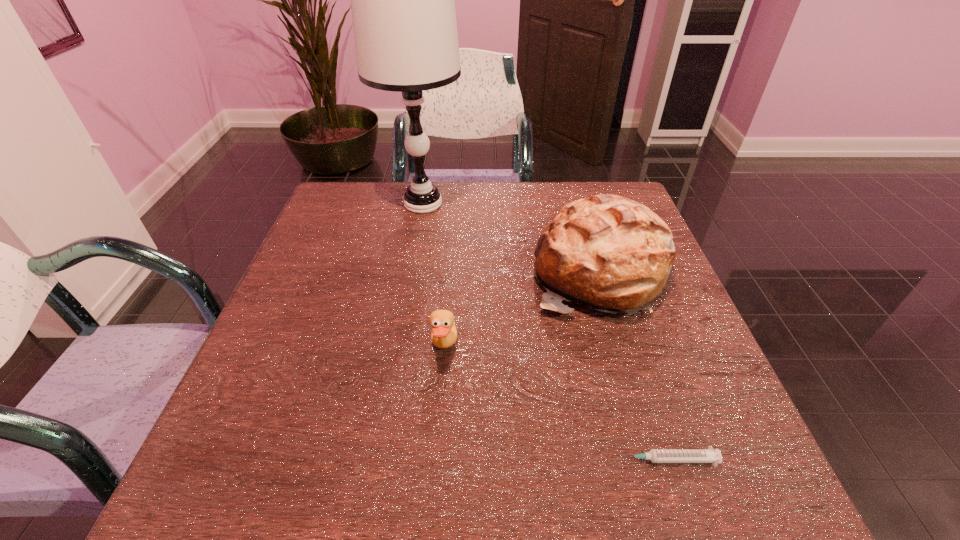
At what (x,y) coordinates should I click in order to perform the action: click on the farthest object. Please return your answer as a coordinate pair (x, y). The height and width of the screenshot is (540, 960). Looking at the image, I should click on (403, 0).

Identify the location of table lamp. The height and width of the screenshot is (540, 960). (403, 0).

I want to click on bread, so click(x=611, y=253).

Where is `the third shortest object`? the third shortest object is located at coordinates (611, 253).

Identify the location of the third tallest object. This screenshot has width=960, height=540. (444, 334).

This screenshot has height=540, width=960. In order to click on the second nearest object in this screenshot , I will do `click(444, 334)`.

Locate an element on the screen. the shortest object is located at coordinates (709, 455).

The image size is (960, 540). What are the coordinates of `the nearest object` in the screenshot? It's located at (709, 455).

At what (x,y) coordinates should I click in order to perform the action: click on vacant space located on the right of the tallest object. Please return your answer as a coordinate pair (x, y). Looking at the image, I should click on (567, 204).

Find the location of a particular element. Image resolution: width=960 pixels, height=540 pixels. free space located 0.110m on the left of the third nearest object is located at coordinates (487, 272).